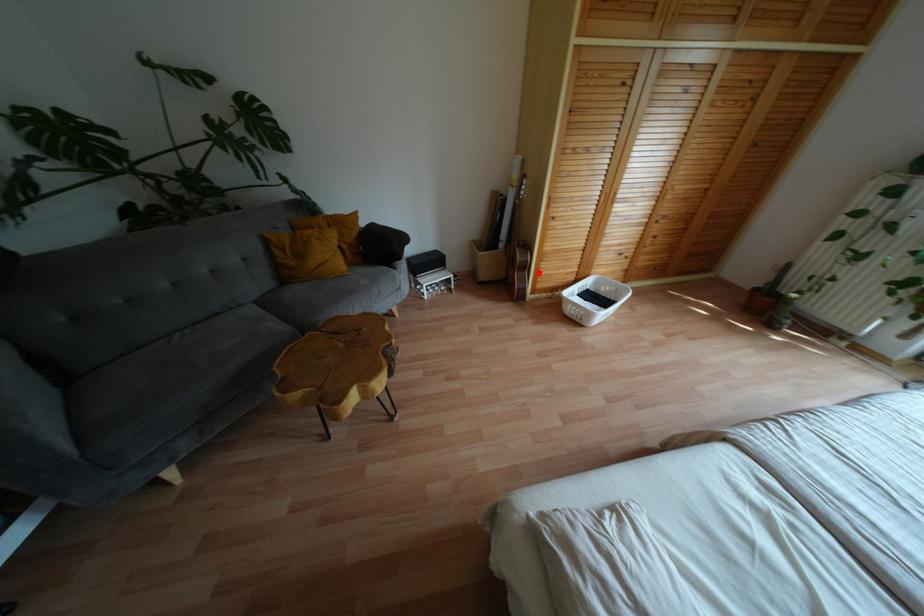
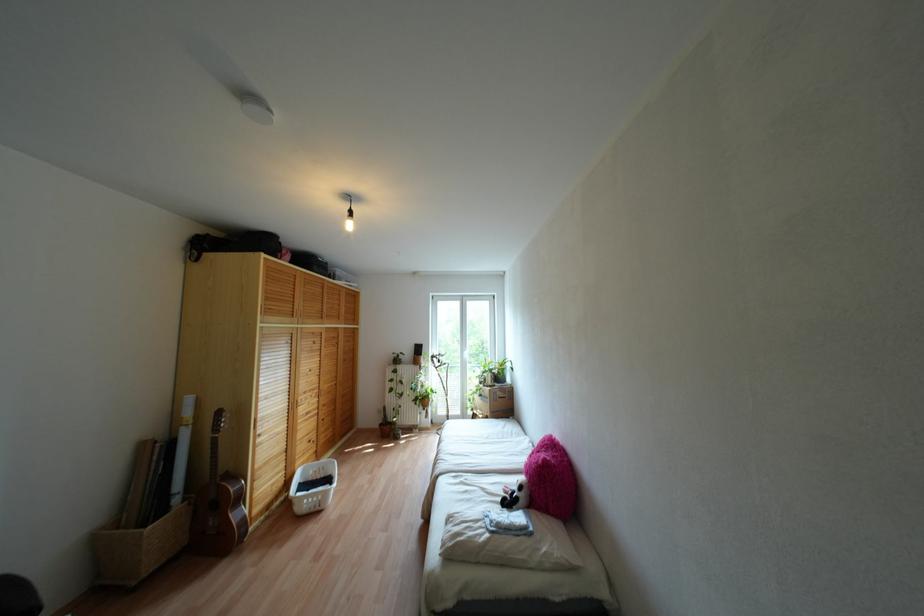
Question: I am providing you with two images of the same scene from different viewpoints. Given a red point in image1, look at the same physical point in image2. Is it:

Choices:
 (A) Closer to the viewpoint
 (B) Farther from the viewpoint

Answer: (B)